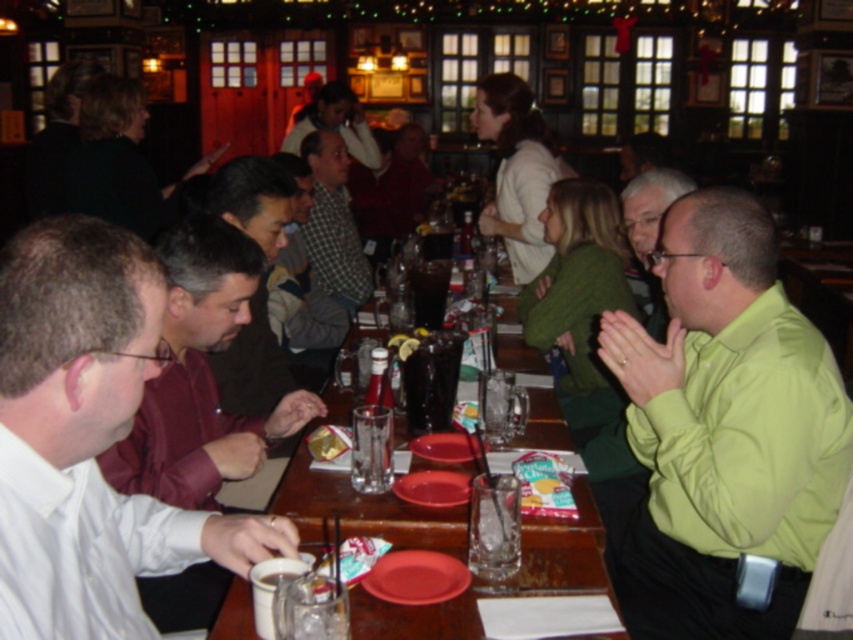
Can you confirm if black glass pitcher at center is bigger than gold foil wrapped candy at center?

Correct, black glass pitcher at center is larger in size than gold foil wrapped candy at center.

Who is more forward, (x=436, y=330) or (x=306, y=444)?

Point (x=306, y=444) is more forward.

Locate an element on the screen. black glass pitcher at center is located at coordinates (431, 381).

The width and height of the screenshot is (853, 640). I want to click on black glass pitcher at center, so click(431, 381).

Is green smooth shirt at right closer to the viewer compared to gold foil wrapped candy at center?

Yes, green smooth shirt at right is in front of gold foil wrapped candy at center.

Does point (837, 486) lie in front of point (349, 440)?

Yes, it is.

Describe the element at coordinates (724, 429) in the screenshot. I see `green smooth shirt at right` at that location.

This screenshot has width=853, height=640. I want to click on green smooth shirt at right, so click(724, 429).

Between black glass pitcher at center and translucent glass cup at center, which one has less height?

black glass pitcher at center is shorter.

Is black glass pitcher at center closer to the viewer compared to translucent glass cup at center?

Yes, it is.

Is point (444, 346) positioned in front of point (431, 276)?

Yes, it is in front of point (431, 276).

The image size is (853, 640). I want to click on black glass pitcher at center, so click(x=431, y=381).